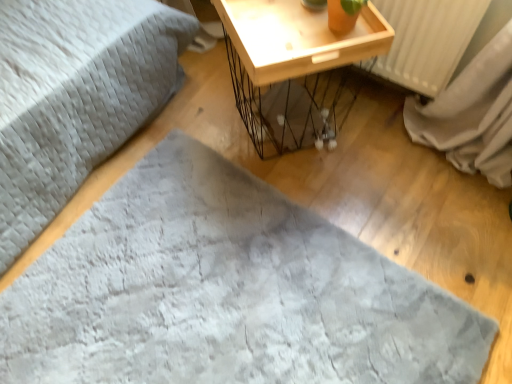
This screenshot has width=512, height=384. I want to click on vacant region under gray soft fabric at center (from a real-world perspective), so click(x=229, y=296).